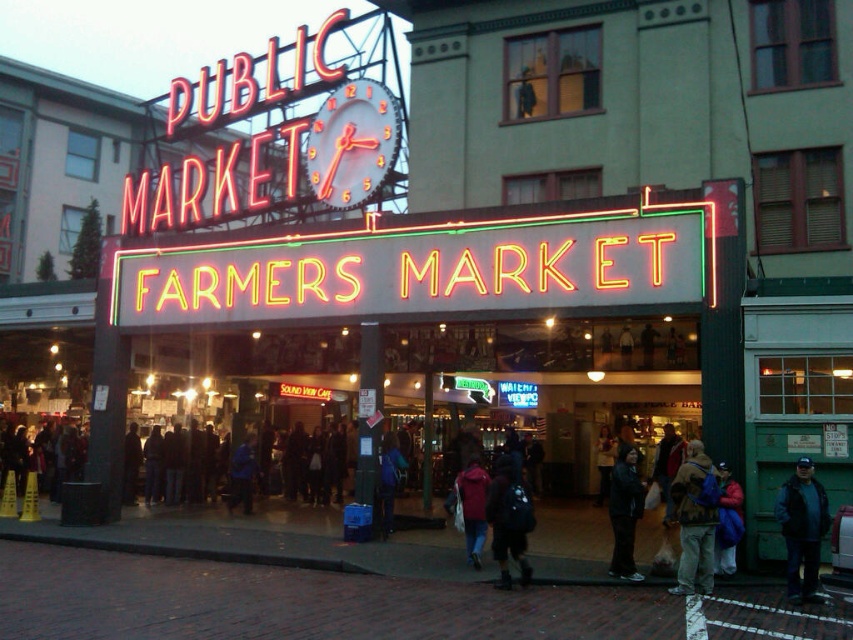
Question: Does neon sign at center have a lesser width compared to dark blue backpack at center?

Choices:
 (A) yes
 (B) no

Answer: (B)

Question: Which object appears closest to the camera in this image?

Choices:
 (A) metallic clock face at upper center
 (B) neon sign at center

Answer: (B)

Question: Which point is farther from the camera taking this photo?

Choices:
 (A) pyautogui.click(x=682, y=552)
 (B) pyautogui.click(x=352, y=204)
 (C) pyautogui.click(x=381, y=436)

Answer: (B)

Question: Which object appears farthest from the camera in this image?

Choices:
 (A) brown fabric backpack at lower right
 (B) dark red jacket at center
 (C) neon sign at center
 (D) dark blue backpack at center

Answer: (B)

Question: Is metallic clock face at upper center positioned at the back of blue fabric jacket at center?

Choices:
 (A) yes
 (B) no

Answer: (A)

Question: Where is neon yellow/gold sign at center located in relation to blue fabric jacket at lower right in the image?

Choices:
 (A) right
 (B) left

Answer: (B)